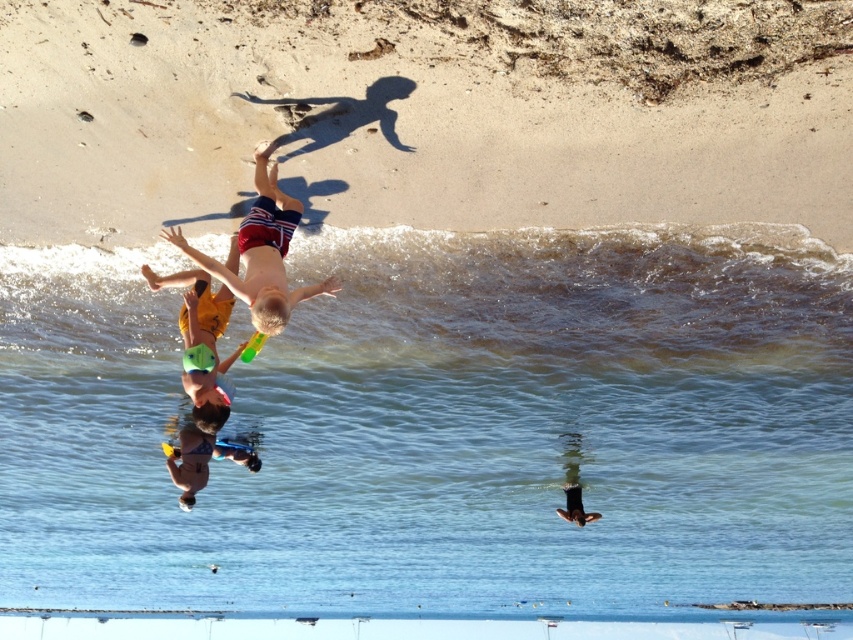
Is beige sand at upper center to the right of blue swimsuit boy at center from the viewer's perspective?

Yes, beige sand at upper center is to the right of blue swimsuit boy at center.

Can you confirm if beige sand at upper center is wider than blue swimsuit boy at center?

Yes, beige sand at upper center is wider than blue swimsuit boy at center.

In order to click on beige sand at upper center in this screenshot , I will do `click(428, 112)`.

You are a GUI agent. You are given a task and a screenshot of the screen. Output one action in this format:
    pyautogui.click(x=<x>, y=<y>)
    Task: Click on the beige sand at upper center
    This screenshot has height=640, width=853.
    Given the screenshot: What is the action you would take?
    pyautogui.click(x=428, y=112)

Which is in front, point (752, 317) or point (259, 182)?

Point (259, 182) is more forward.

This screenshot has width=853, height=640. Find the location of `clear water at wave upper`. clear water at wave upper is located at coordinates (573, 300).

Does clear water at wave upper have a larger size compared to blue swimsuit boy at center?

Actually, clear water at wave upper might be smaller than blue swimsuit boy at center.

Between point (468, 360) and point (236, 454), which one is positioned in front?

Positioned in front is point (468, 360).

Who is more forward, (374,321) or (181,452)?

Positioned in front is point (374,321).

Find the location of a particular element. clear water at wave upper is located at coordinates (573, 300).